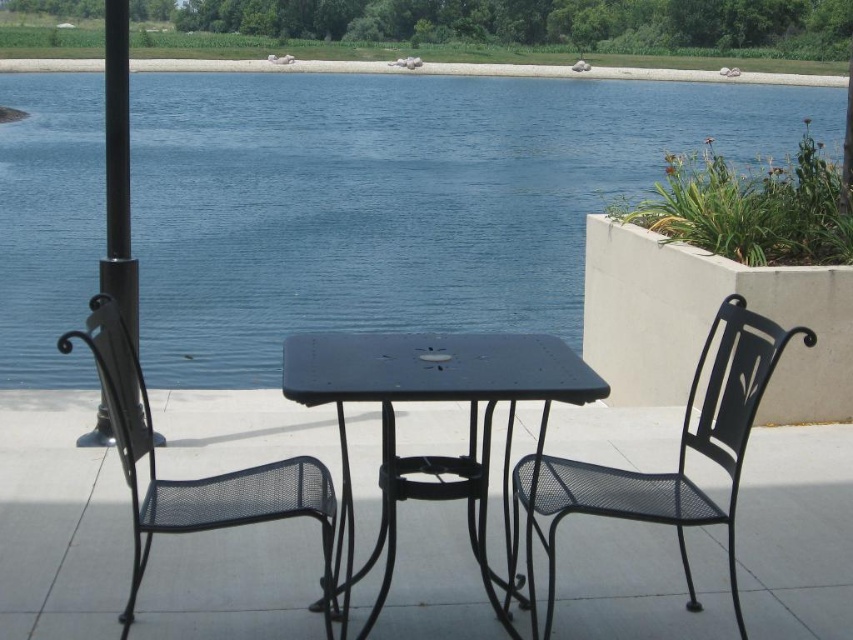
Is blue water at center bigger than black mesh chair at right?

Indeed, blue water at center has a larger size compared to black mesh chair at right.

Does point (531, 250) come closer to viewer compared to point (763, 321)?

No, (531, 250) is further to viewer.

I want to click on blue water at center, so click(398, 198).

Can you confirm if black mesh chair at left is wider than black metal pole at left?

No, black mesh chair at left is not wider than black metal pole at left.

Does black mesh chair at left lie behind black metal pole at left?

No, black mesh chair at left is closer to the viewer.

Where is `black mesh chair at left`? This screenshot has width=853, height=640. black mesh chair at left is located at coordinates (193, 477).

Is point (305, 397) farther from camera compared to point (332, 518)?

That is False.

Does black wrought iron table at center have a smaller size compared to black mesh chair at left?

Yes, black wrought iron table at center is smaller than black mesh chair at left.

You are a GUI agent. You are given a task and a screenshot of the screen. Output one action in this format:
    pyautogui.click(x=<x>, y=<y>)
    Task: Click on the black wrought iron table at center
    The height and width of the screenshot is (640, 853).
    Given the screenshot: What is the action you would take?
    pyautogui.click(x=433, y=456)